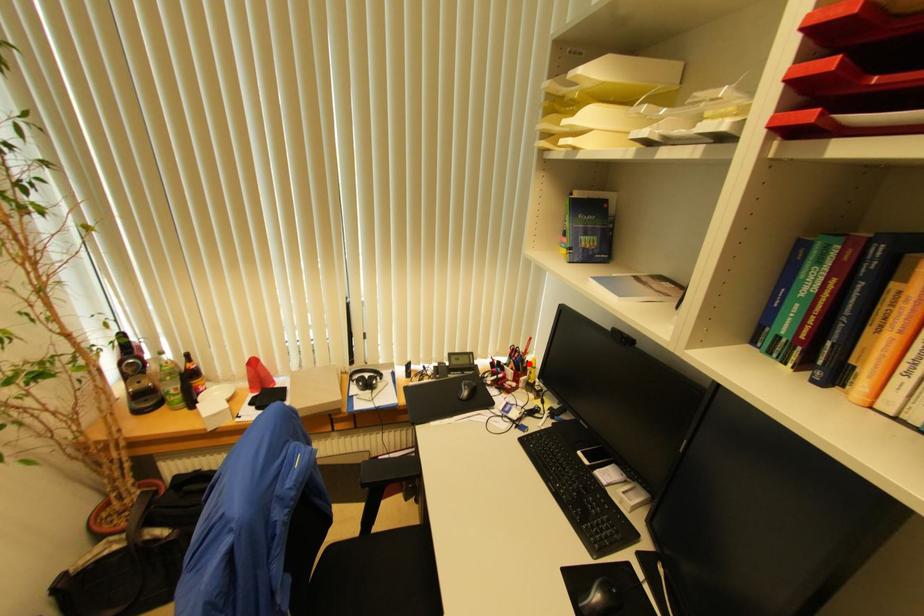
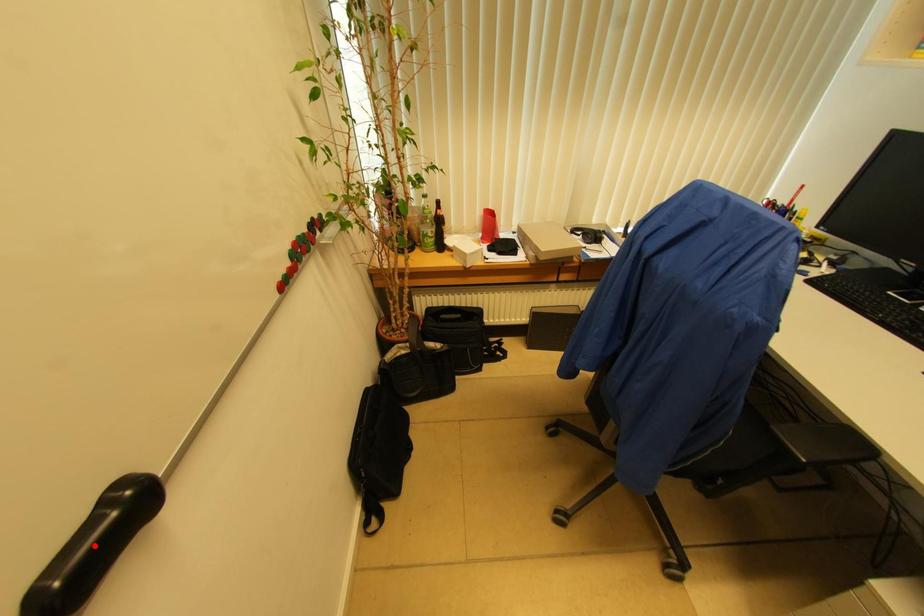
I am providing you with two images of the same scene from different viewpoints. A red point is marked on the first image and another point is marked on the second image. Is the marked point in image1 the same physical position as the marked point in image2?

No